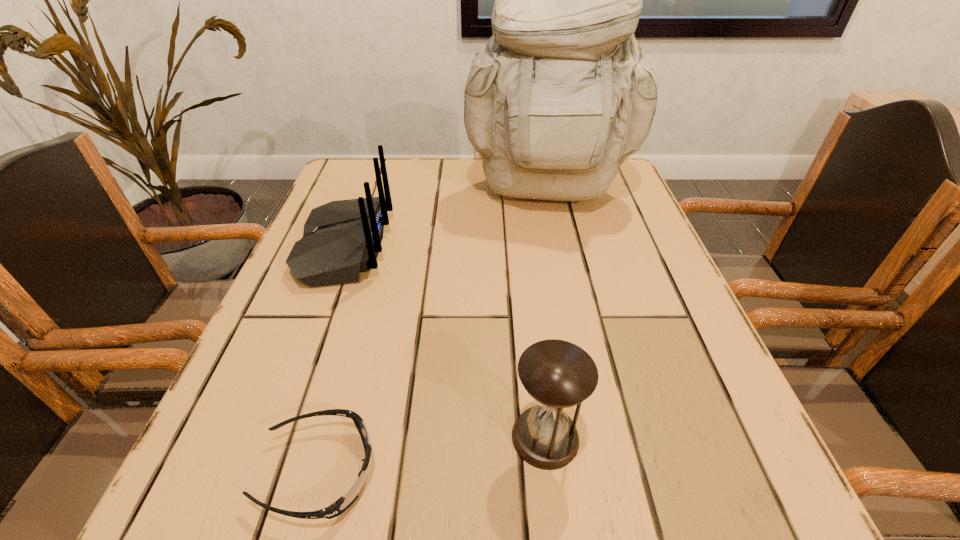
The height and width of the screenshot is (540, 960). Identify the location of free space at the far left corner of the desktop. (370, 180).

Where is `free region at the near right corner`? free region at the near right corner is located at coordinates (773, 529).

This screenshot has height=540, width=960. Identify the location of vacant space that's between the second shortest object and the backpack. (546, 315).

The height and width of the screenshot is (540, 960). Identify the location of vacant point located between the third shortest object and the sunglasses. [x=332, y=359].

Where is `vacant point located between the tallest object and the sunglasses`? The width and height of the screenshot is (960, 540). vacant point located between the tallest object and the sunglasses is located at coordinates (433, 332).

In order to click on blank region between the tallest object and the second shortest object in this screenshot , I will do `click(546, 315)`.

Find the location of `unoccupied area between the hourglass and the backpack`. unoccupied area between the hourglass and the backpack is located at coordinates (546, 315).

At what (x,y) coordinates should I click in order to perform the action: click on vacant point located between the tallest object and the second shortest object. Please return your answer as a coordinate pair (x, y). The width and height of the screenshot is (960, 540). Looking at the image, I should click on (546, 315).

Locate an element on the screen. Image resolution: width=960 pixels, height=540 pixels. unoccupied area between the router and the backpack is located at coordinates (446, 220).

Identify the location of unoccupied position between the shortest object and the second shortest object. The image size is (960, 540). (432, 454).